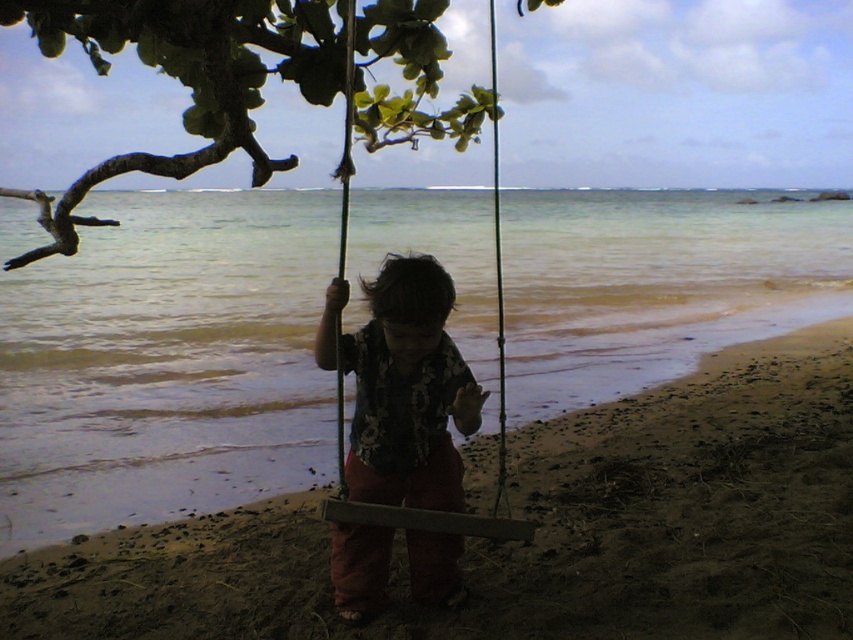
Can you confirm if brown sandy beach at center is bigger than floral shirt at center?

No, brown sandy beach at center is not bigger than floral shirt at center.

Between point (283, 608) and point (428, 584), which one is positioned in front?

Point (428, 584)

Who is more forward, (766, 467) or (384, 432)?

Point (384, 432) is in front.

You are a GUI agent. You are given a task and a screenshot of the screen. Output one action in this format:
    pyautogui.click(x=<x>, y=<y>)
    Task: Click on the brown sandy beach at center
    This screenshot has width=853, height=640.
    Given the screenshot: What is the action you would take?
    pyautogui.click(x=537, y=531)

Which is in front, point (398, 340) or point (515, 532)?

Point (398, 340) is more forward.

Does floral shirt at center come behind wooden swing at center?

Yes, it is behind wooden swing at center.

Identify the location of floral shirt at center. [408, 390].

This screenshot has width=853, height=640. What are the coordinates of `floral shirt at center` in the screenshot? It's located at (408, 390).

Which is above, brown sandy beach at center or green leafy branch at upper left?

green leafy branch at upper left is above.

The height and width of the screenshot is (640, 853). I want to click on brown sandy beach at center, so click(x=537, y=531).

The image size is (853, 640). I want to click on brown sandy beach at center, so click(x=537, y=531).